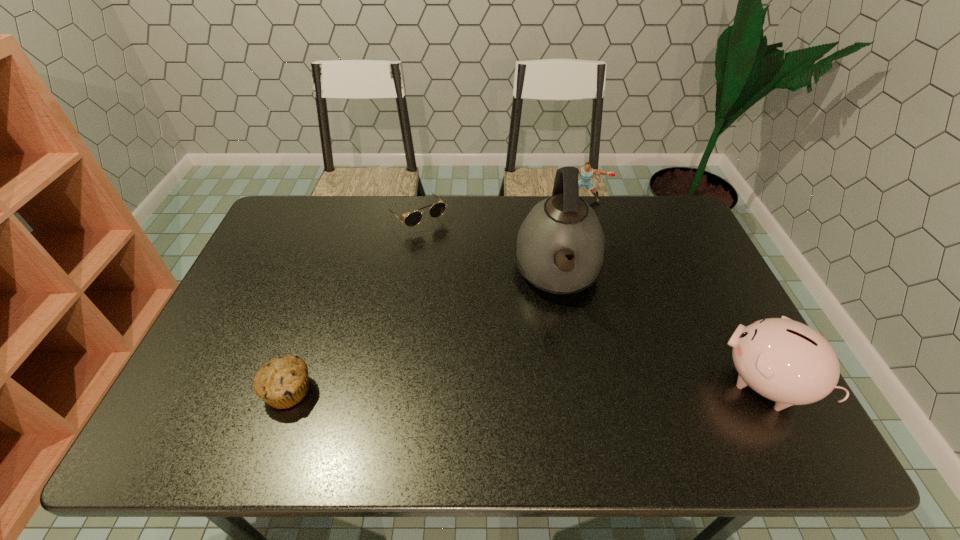
Find the location of a particular element. The height and width of the screenshot is (540, 960). empty space between the second tallest object and the second object from left to right is located at coordinates (590, 300).

You are a GUI agent. You are given a task and a screenshot of the screen. Output one action in this format:
    pyautogui.click(x=<x>, y=<y>)
    Task: Click on the free area in between the puncher and the leftmost object
    
    Given the screenshot: What is the action you would take?
    pyautogui.click(x=435, y=295)

Find the location of a particular element. free space between the tallest object and the leftmost object is located at coordinates (423, 332).

In order to click on empty space that is in between the tallest object and the rightmost object in this screenshot , I will do tap(660, 328).

Find the location of a particular element. The width and height of the screenshot is (960, 540). empty location between the tallest object and the fourth object from right to left is located at coordinates (488, 245).

Image resolution: width=960 pixels, height=540 pixels. Identify the location of vacant area that lies between the tallest object and the second tallest object. (660, 328).

What are the coordinates of `free spot between the sunglasses and the tallest object` in the screenshot? It's located at (488, 245).

The height and width of the screenshot is (540, 960). Identify the location of vacant space that's between the third tallest object and the rightmost object. (672, 292).

The image size is (960, 540). What are the coordinates of `the fourth closest object to the kettle` in the screenshot? It's located at (282, 382).

Select which object appears as the closest to the puncher. Please provide its 2D coordinates. Your answer should be formatted as a tuple, i.e. [(x, y)], where the tuple contains the x and y coordinates of a point satisfying the conditions above.

[(563, 226)]